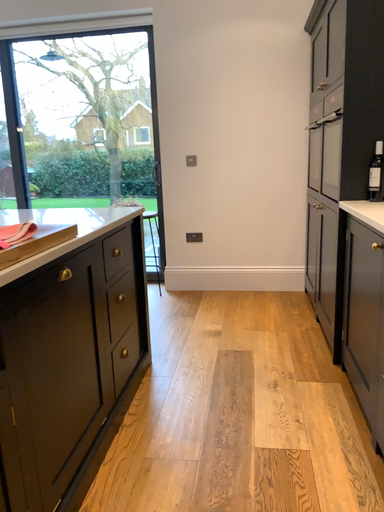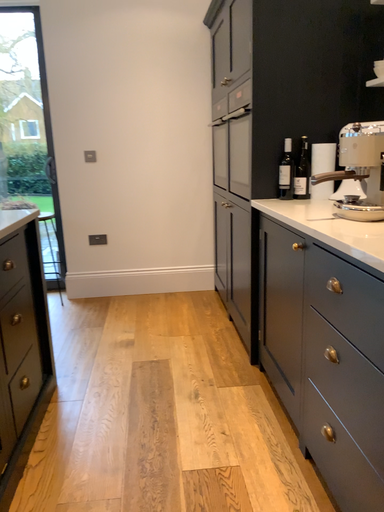
Question: Which way did the camera rotate in the video?

Choices:
 (A) rotated right
 (B) rotated left

Answer: (A)